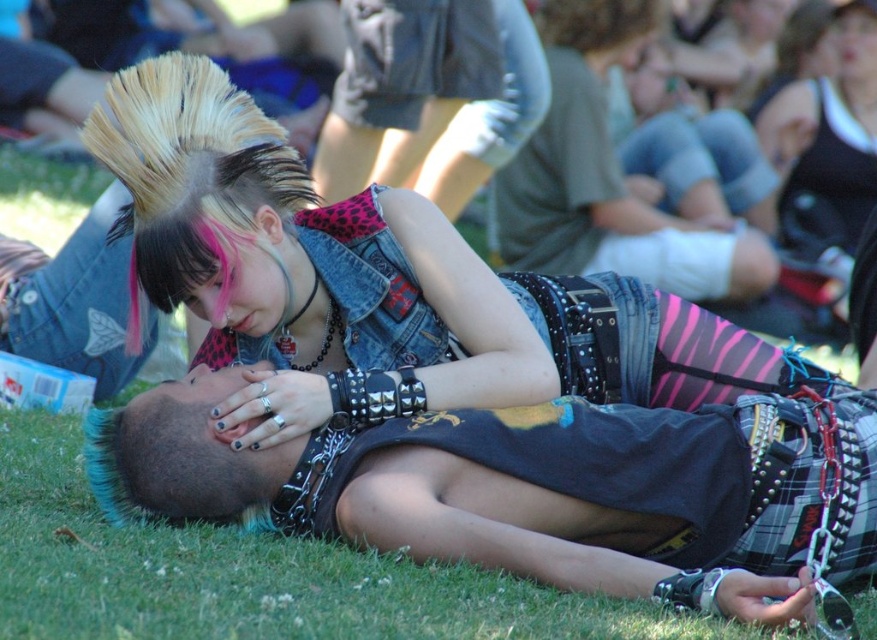
What is located at the point with coordinates (330,275) in the image?

The point at coordinates (330,275) is where the denim vest at center is located.

You are standing at the edge of the music festival field and see the dark gray fabric shirt at center. If you want to approach and hand them a flyer, how many large steps would you estimate you need to take to reach them?

The dark gray fabric shirt at center is 3.09 meters away. Assuming an average large step is about 0.75 meters, you would need approximately 4 large steps to reach them.

You are a photographer at the music festival trying to capture the two people lying on the grass. You want to ensure that the dark gray fabric shirt at center and the denim shorts at center are visible in the frame. Based on their positions, which one should you focus on first to make sure both are in the shot?

The dark gray fabric shirt at center is located below the denim shorts at center, so you should focus on the denim shorts at center first to ensure both are visible in the frame.